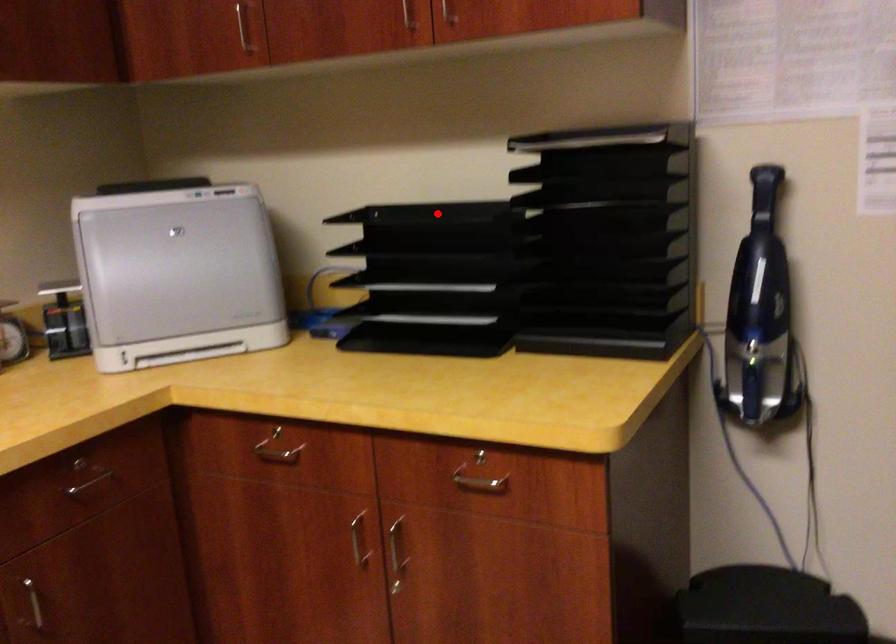
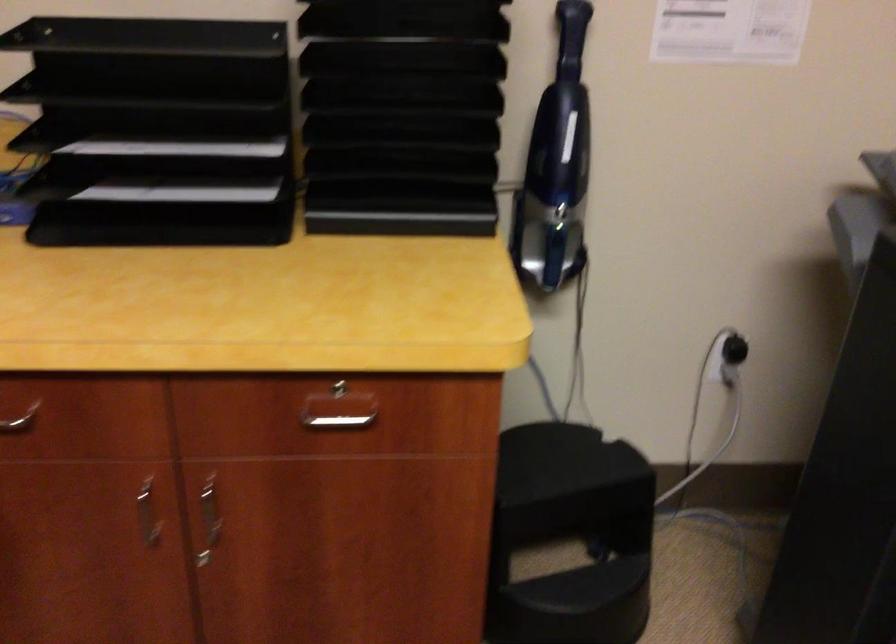
Locate, in the second image, the point that corresponds to the highlighted location in the first image.

(151, 38)